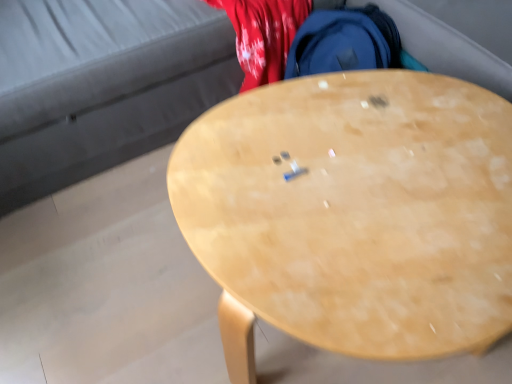
Question: Considering the positions of velvet grey couch at upper center and light wood desk at center in the image, is velvet grey couch at upper center taller or shorter than light wood desk at center?

Choices:
 (A) short
 (B) tall

Answer: (B)

Question: Is point (177, 74) positioned closer to the camera than point (325, 110)?

Choices:
 (A) farther
 (B) closer

Answer: (A)

Question: Choose the correct answer: Is velvet grey couch at upper center inside light wood desk at center or outside it?

Choices:
 (A) inside
 (B) outside

Answer: (B)

Question: From a real-world perspective, is light wood desk at center positioned above or below velvet grey couch at upper center?

Choices:
 (A) below
 (B) above

Answer: (A)

Question: In terms of size, does light wood desk at center appear bigger or smaller than velvet grey couch at upper center?

Choices:
 (A) small
 (B) big

Answer: (A)

Question: Is light wood desk at center in front of or behind velvet grey couch at upper center in the image?

Choices:
 (A) behind
 (B) front

Answer: (B)

Question: Is light wood desk at center situated inside velvet grey couch at upper center or outside?

Choices:
 (A) outside
 (B) inside

Answer: (A)